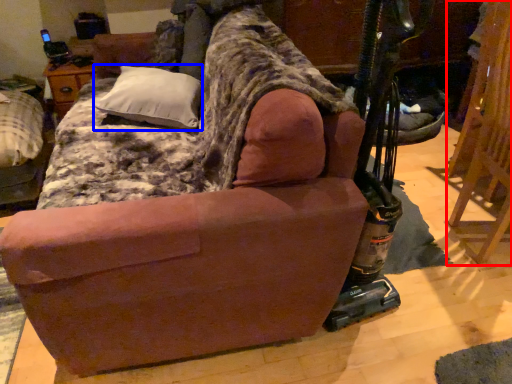
Question: Which of the following is the closest to the observer, folding chair (highlighted by a red box) or pillow (highlighted by a blue box)?

Choices:
 (A) folding chair
 (B) pillow

Answer: (A)